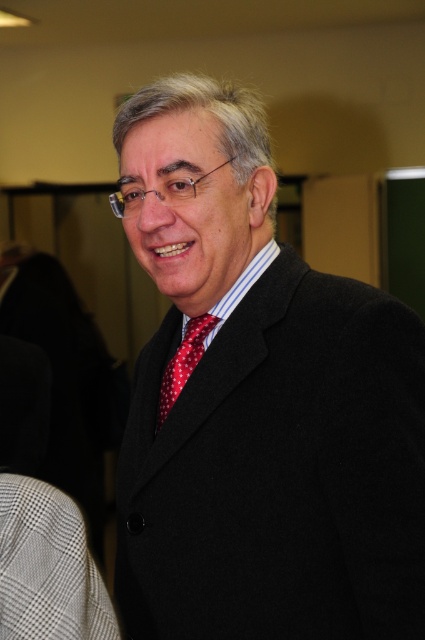
Is matte black suit at center smaller than red dotted tie at center?

No, matte black suit at center is not smaller than red dotted tie at center.

Can you confirm if matte black suit at center is bigger than red dotted tie at center?

Indeed, matte black suit at center has a larger size compared to red dotted tie at center.

Locate an element on the screen. This screenshot has width=425, height=640. matte black suit at center is located at coordinates (260, 403).